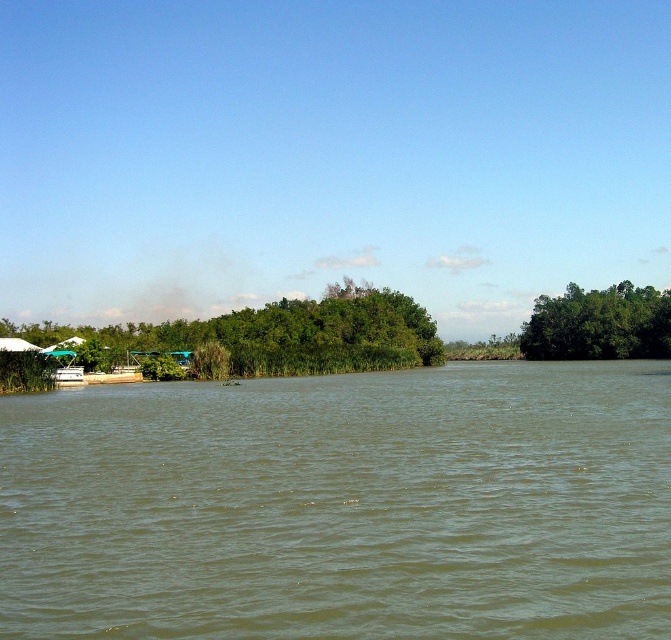
Question: Can you confirm if green leafy trees at center is thinner than green leafy trees at right?

Choices:
 (A) yes
 (B) no

Answer: (B)

Question: Is greenish-brown water at center bigger than green leafy trees at right?

Choices:
 (A) no
 (B) yes

Answer: (A)

Question: Which object appears farthest from the camera in this image?

Choices:
 (A) green leafy trees at center
 (B) greenish-brown water at center

Answer: (A)

Question: Which object appears closest to the camera in this image?

Choices:
 (A) greenish-brown water at center
 (B) green leafy trees at center

Answer: (A)

Question: Which object is the farthest from the green leafy trees at right?

Choices:
 (A) green leafy trees at center
 (B) greenish-brown water at center

Answer: (B)

Question: Is green leafy trees at center bigger than green leafy trees at right?

Choices:
 (A) yes
 (B) no

Answer: (A)